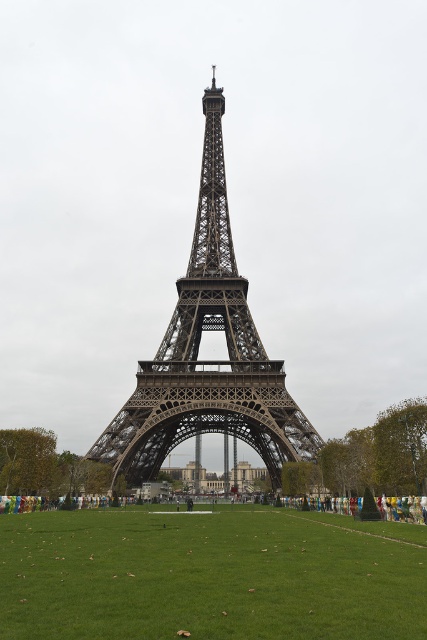
Question: Does green grass at center have a lesser width compared to dark gray metal eiffel tower at center?

Choices:
 (A) yes
 (B) no

Answer: (B)

Question: Can you confirm if green grass at center is bigger than dark gray metal eiffel tower at center?

Choices:
 (A) no
 (B) yes

Answer: (A)

Question: Which point is farther to the camera?

Choices:
 (A) (222, 212)
 (B) (94, 637)

Answer: (A)

Question: Does green grass at center come in front of dark gray metal eiffel tower at center?

Choices:
 (A) no
 (B) yes

Answer: (B)